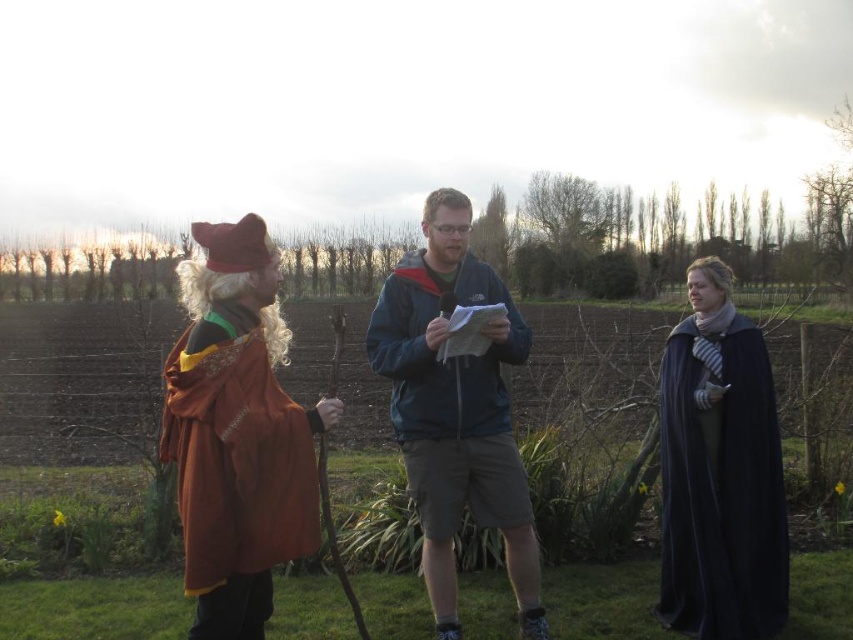
Which is behind, point (459, 630) or point (764, 349)?

Positioned behind is point (764, 349).

Image resolution: width=853 pixels, height=640 pixels. What do you see at coordinates (456, 410) in the screenshot? I see `dark blue jacket at center` at bounding box center [456, 410].

Does point (502, 449) come in front of point (711, 481)?

Yes, point (502, 449) is in front of point (711, 481).

Where is `dark blue jacket at center`? dark blue jacket at center is located at coordinates (456, 410).

Which is in front, point (248, 538) or point (401, 310)?

Positioned in front is point (248, 538).

Is velvet orange cloak at left in front of dark blue jacket at center?

Yes.

Identify the location of velvet orange cloak at left. This screenshot has width=853, height=640. (236, 433).

You are a GUI agent. You are given a task and a screenshot of the screen. Output one action in this format:
    pyautogui.click(x=<x>, y=<y>)
    Task: Click on the velvet orange cloak at left
    The image size is (853, 640).
    Given the screenshot: What is the action you would take?
    pyautogui.click(x=236, y=433)

Can you confirm if velvet orange cloak at left is taller than dark blue velvet cape at right?

In fact, velvet orange cloak at left may be shorter than dark blue velvet cape at right.

Looking at this image, can you confirm if velvet orange cloak at left is wider than dark blue velvet cape at right?

No, velvet orange cloak at left is not wider than dark blue velvet cape at right.

Which is in front, point (201, 573) or point (712, 541)?

Positioned in front is point (201, 573).

Identify the location of velvet orange cloak at left. (236, 433).